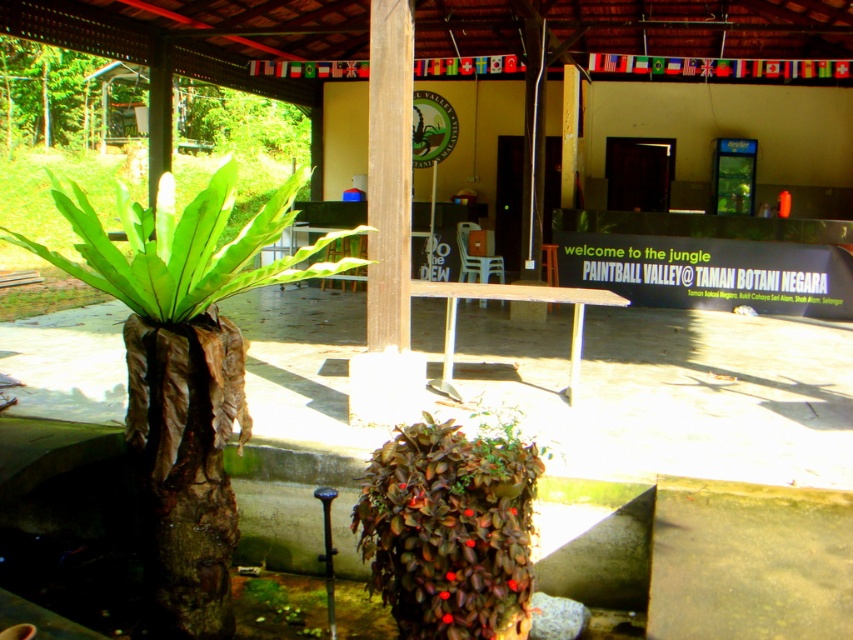
Does green leafy plant at left appear under leathery brown plant at center?

Incorrect, green leafy plant at left is not positioned below leathery brown plant at center.

Is green leafy plant at left positioned before leathery brown plant at center?

No, green leafy plant at left is behind leathery brown plant at center.

Is point (201, 580) in front of point (374, 497)?

No, (201, 580) is behind (374, 497).

The height and width of the screenshot is (640, 853). Find the location of `green leafy plant at left`. green leafy plant at left is located at coordinates (184, 369).